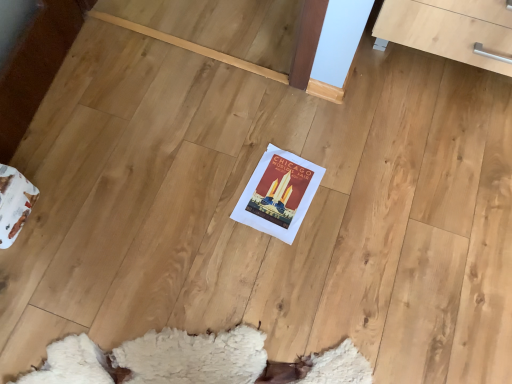
Image resolution: width=512 pixels, height=384 pixels. I want to click on vacant area that lies to the right of white paper magazine at center, so click(x=350, y=199).